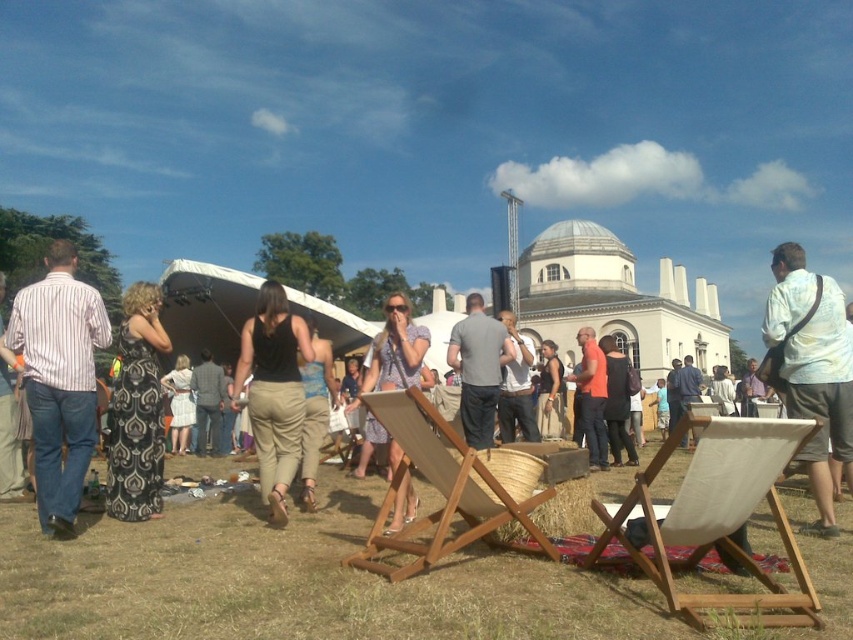
Question: Among these points, which one is farthest from the camera?

Choices:
 (A) (293, 358)
 (B) (158, 332)
 (C) (204, 396)
 (D) (634, 454)

Answer: (C)

Question: Which of these objects is positioned farthest from the black tank top at center?

Choices:
 (A) black matte dress at center
 (B) blue textured dress at center
 (C) white cotton shirt at center

Answer: (A)

Question: Does green grass at lower center appear on the right side of black matte dress at center?

Choices:
 (A) yes
 (B) no

Answer: (A)

Question: Is black printed dress at left thinner than blue textured dress at center?

Choices:
 (A) no
 (B) yes

Answer: (A)

Question: Which object is closer to the camera taking this photo?

Choices:
 (A) matte gray shirt at center
 (B) denim jacket at center

Answer: (A)

Question: Can you confirm if black printed dress at left is wider than black dress at center?

Choices:
 (A) no
 (B) yes

Answer: (A)